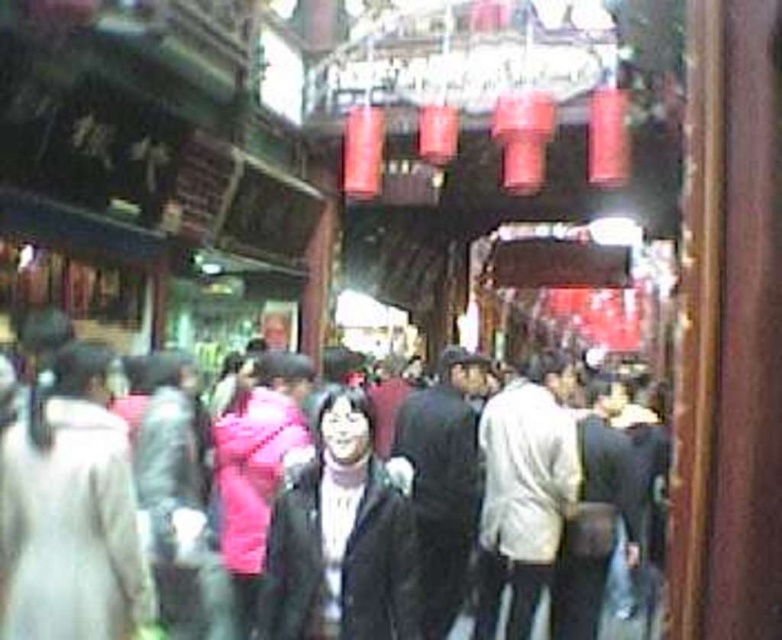
Does black matte jacket at center appear on the right side of dark gray jacket at center?

No, black matte jacket at center is not to the right of dark gray jacket at center.

Does black matte jacket at center have a lesser width compared to dark gray jacket at center?

Incorrect, black matte jacket at center's width is not less than dark gray jacket at center's.

Which is in front, point (329, 468) or point (598, 467)?

Point (329, 468) is more forward.

Locate an element on the screen. This screenshot has height=640, width=782. black matte jacket at center is located at coordinates (339, 540).